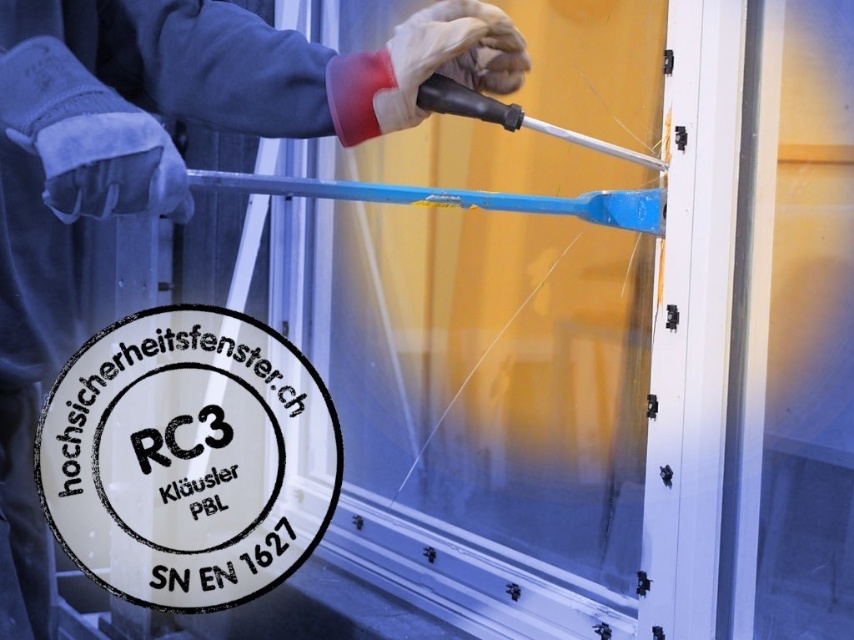
You are a construction worker trying to identify the correct tool to use for assembling the window frame. You have a blue plastic tool at upper center and a white leather glove at upper center. Which one is bigger?

The blue plastic tool at upper center is larger in size than the white leather glove at upper center, so the blue plastic tool at upper center is bigger.

You are a safety inspector checking the workspace. You notice the blue plastic tool at upper center and the white leather glove at upper center. Are these two items within a safe distance of 20 centimeters from each other?

The distance between the blue plastic tool at upper center and the white leather glove at upper center is 19.67 centimeters, which is under 20 centimeters, so they are within a safe distance.

You are a technician installing a high security window. You have a blue plastic tool at upper center and a white leather glove at upper center. Which object is taller?

The blue plastic tool at upper center is taller than the white leather glove at upper center.